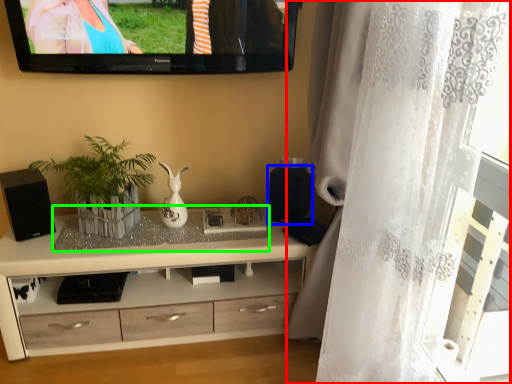
Question: Which object is positioned farthest from curtain (highlighted by a red box)? Select from speaker (highlighted by a blue box) and glass table (highlighted by a green box).

Choices:
 (A) speaker
 (B) glass table

Answer: (B)